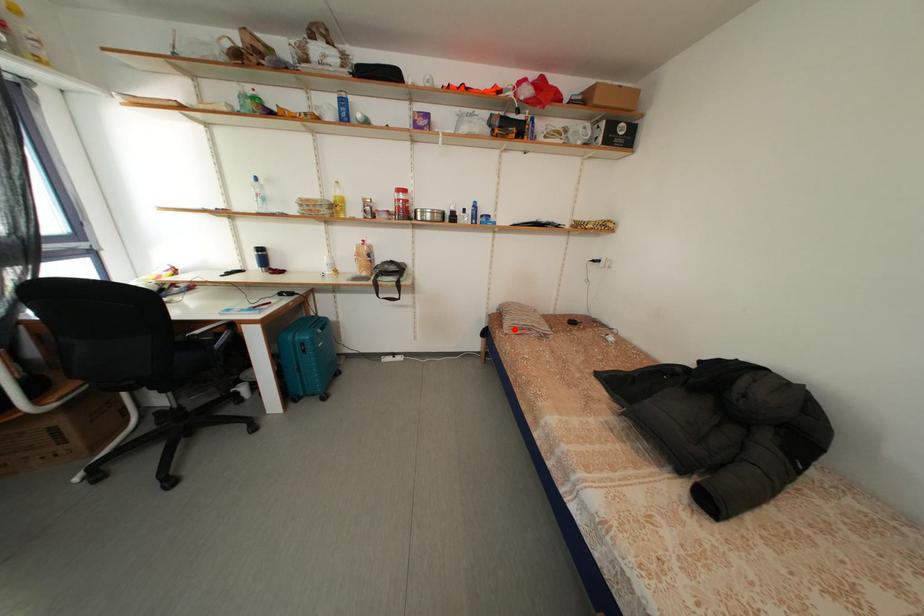
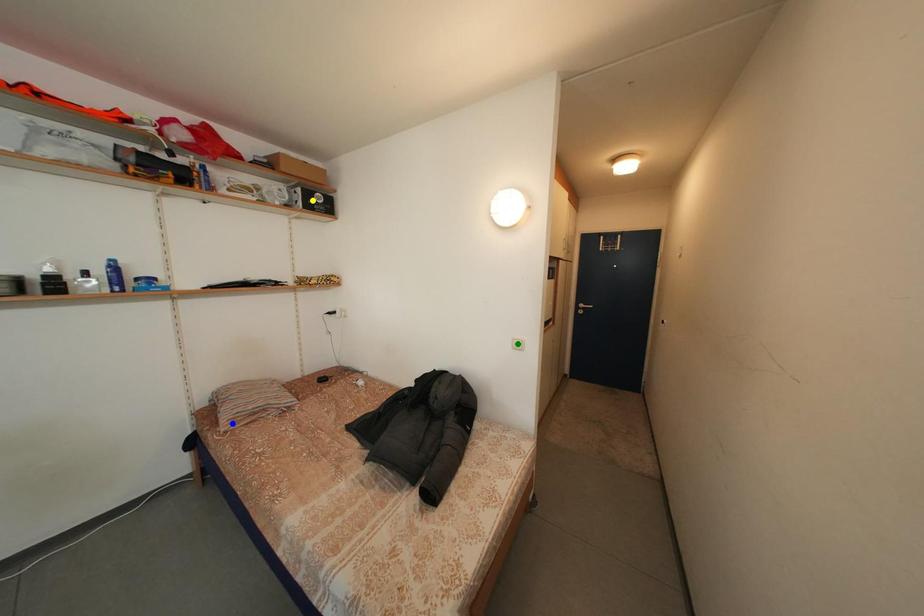
Question: I am providing you with two images of the same scene from different viewpoints. A red point is marked on the first image. You are given multiple points on the second image. Which mark in image 2 goes with the point in image 1?

Choices:
 (A) yellow point
 (B) green point
 (C) blue point

Answer: (C)